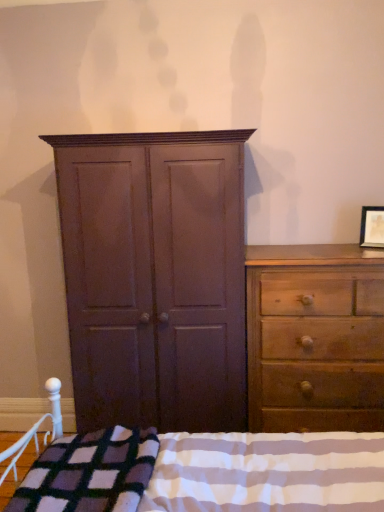
At what (x,y) coordinates should I click in order to perform the action: click on plaid wool blanket at lower center. Please return your answer as a coordinate pair (x, y). Image resolution: width=384 pixels, height=512 pixels. Looking at the image, I should click on (198, 471).

This screenshot has height=512, width=384. What do you see at coordinates (372, 227) in the screenshot? I see `matte wooden picture frame at upper right` at bounding box center [372, 227].

What do you see at coordinates (315, 338) in the screenshot? This screenshot has height=512, width=384. I see `wooden dresser at right` at bounding box center [315, 338].

Where is `plaid wool blanket at lower center`? Image resolution: width=384 pixels, height=512 pixels. plaid wool blanket at lower center is located at coordinates (198, 471).

Considering the sizes of objects plaid wool blanket at lower center and wooden dresser at right in the image provided, who is bigger, plaid wool blanket at lower center or wooden dresser at right?

plaid wool blanket at lower center is bigger.

From a real-world perspective, is plaid wool blanket at lower center below wooden dresser at right?

Incorrect, from a real-world perspective, plaid wool blanket at lower center is higher than wooden dresser at right.

What's the angular difference between plaid wool blanket at lower center and wooden dresser at right's facing directions?

The angle between the facing direction of plaid wool blanket at lower center and the facing direction of wooden dresser at right is 91.6 degrees.

Considering the relative positions of plaid wool blanket at lower center and wooden dresser at right in the image provided, is plaid wool blanket at lower center to the left of wooden dresser at right from the viewer's perspective?

Correct, you'll find plaid wool blanket at lower center to the left of wooden dresser at right.

Is matte wooden picture frame at upper right taller than plaid wool blanket at lower center?

No.

The height and width of the screenshot is (512, 384). I want to click on picture frame on the right of plaid wool blanket at lower center, so click(x=372, y=227).

From a real-world perspective, is matte wooden picture frame at upper right above or below plaid wool blanket at lower center?

Clearly, from a real-world perspective, matte wooden picture frame at upper right is above plaid wool blanket at lower center.

Who is more distant, matte wooden picture frame at upper right or plaid wool blanket at lower center?

matte wooden picture frame at upper right is further away from the camera.

Based on the photo, which is nearer, (151, 451) or (378, 211)?

The point (151, 451) is closer.

Are plaid wool blanket at lower center and matte wooden picture frame at upper right making contact?

There is a gap between plaid wool blanket at lower center and matte wooden picture frame at upper right.

Considering the positions of objects plaid wool blanket at lower center and matte wooden picture frame at upper right in the image provided, who is behind, plaid wool blanket at lower center or matte wooden picture frame at upper right?

Positioned behind is matte wooden picture frame at upper right.

Between plaid wool blanket at lower center and matte wooden picture frame at upper right, which one has less height?

With less height is matte wooden picture frame at upper right.

From the image's perspective, would you say matte wooden picture frame at upper right is positioned over matte brown cupboard at center?

Yes, from the image's perspective, matte wooden picture frame at upper right is over matte brown cupboard at center.

Between point (375, 210) and point (73, 353), which one is positioned in front?

The point (73, 353) is closer to the camera.

Is matte brown cupboard at center at the back of matte wooden picture frame at upper right?

No, matte wooden picture frame at upper right is not facing the opposite direction of matte brown cupboard at center.

Who is more distant, matte wooden picture frame at upper right or matte brown cupboard at center?

Positioned behind is matte wooden picture frame at upper right.

Locate an element on the screen. This screenshot has width=384, height=512. cupboard behind the plush purple blanket at lower left is located at coordinates (155, 277).

Is plush purple blanket at lower left in front of or behind matte brown cupboard at center in the image?

Clearly, plush purple blanket at lower left is in front of matte brown cupboard at center.

Is plush purple blanket at lower left aimed at matte brown cupboard at center?

No, plush purple blanket at lower left is not aimed at matte brown cupboard at center.

Is wooden dresser at right spatially inside plaid wool blanket at lower center, or outside of it?

The correct answer is: outside.

From the picture: From the image's perspective, does wooden dresser at right appear lower than plaid wool blanket at lower center?

No, from the image's perspective, wooden dresser at right is not below plaid wool blanket at lower center.

In the image, is wooden dresser at right positioned in front of or behind plaid wool blanket at lower center?

Visually, wooden dresser at right is located behind plaid wool blanket at lower center.

Between wooden dresser at right and plaid wool blanket at lower center, which one appears on the left side from the viewer's perspective?

From the viewer's perspective, plaid wool blanket at lower center appears more on the left side.

Is point (274, 271) closer or farther from the camera than point (154, 441)?

Point (274, 271) is positioned farther from the camera compared to point (154, 441).

Considering the relative sizes of wooden dresser at right and plush purple blanket at lower left in the image provided, is wooden dresser at right wider than plush purple blanket at lower left?

In fact, wooden dresser at right might be narrower than plush purple blanket at lower left.

Is wooden dresser at right behind plush purple blanket at lower left?

Yes, wooden dresser at right is behind plush purple blanket at lower left.

The width and height of the screenshot is (384, 512). Find the location of `the chest of drawers that is under the plaid wool blanket at lower center (from a real-world perspective)`. the chest of drawers that is under the plaid wool blanket at lower center (from a real-world perspective) is located at coordinates (315, 338).

What are the coordinates of `bed lying on the left of matte wooden picture frame at upper right` in the screenshot? It's located at (198, 471).

From the image, which object appears to be farther from matte wooden picture frame at upper right, plush purple blanket at lower left or matte brown cupboard at center?

plush purple blanket at lower left is further to matte wooden picture frame at upper right.

When comparing their distances from matte brown cupboard at center, does matte wooden picture frame at upper right or plaid wool blanket at lower center seem further?

matte wooden picture frame at upper right.

When comparing their distances from plaid wool blanket at lower center, does matte wooden picture frame at upper right or plush purple blanket at lower left seem closer?

Among the two, plush purple blanket at lower left is located nearer to plaid wool blanket at lower center.

Looking at the image, which one is located further to matte brown cupboard at center, plaid wool blanket at lower center or wooden dresser at right?

plaid wool blanket at lower center lies further to matte brown cupboard at center than the other object.

Which object lies further to the anchor point wooden dresser at right, matte wooden picture frame at upper right or plush purple blanket at lower left?

plush purple blanket at lower left is positioned further to the anchor wooden dresser at right.

Estimate the real-world distances between objects in this image. Which object is closer to matte wooden picture frame at upper right, plaid wool blanket at lower center or matte brown cupboard at center?

Among the two, matte brown cupboard at center is located nearer to matte wooden picture frame at upper right.

Looking at the image, which one is located further to plaid wool blanket at lower center, matte brown cupboard at center or plush purple blanket at lower left?

The object further to plaid wool blanket at lower center is matte brown cupboard at center.

When comparing their distances from wooden dresser at right, does plaid wool blanket at lower center or matte wooden picture frame at upper right seem further?

plaid wool blanket at lower center is positioned further to the anchor wooden dresser at right.

At what (x,y) coordinates should I click in order to perform the action: click on the chest of drawers located between plaid wool blanket at lower center and matte wooden picture frame at upper right in the depth direction. Please return your answer as a coordinate pair (x, y). The height and width of the screenshot is (512, 384). Looking at the image, I should click on (315, 338).

The width and height of the screenshot is (384, 512). Find the location of `blanket between plaid wool blanket at lower center and wooden dresser at right along the z-axis`. blanket between plaid wool blanket at lower center and wooden dresser at right along the z-axis is located at coordinates (90, 472).

Where is `cupboard between plush purple blanket at lower left and wooden dresser at right from left to right`? cupboard between plush purple blanket at lower left and wooden dresser at right from left to right is located at coordinates (155, 277).

Identify the location of cupboard positioned between plaid wool blanket at lower center and matte wooden picture frame at upper right from near to far. Image resolution: width=384 pixels, height=512 pixels. (155, 277).